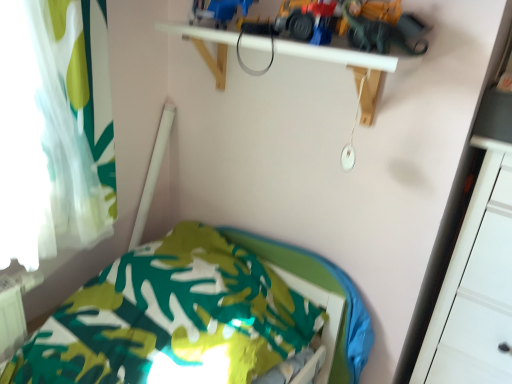
Question: Is point (384, 26) positioned closer to the camera than point (215, 13)?

Choices:
 (A) closer
 (B) farther

Answer: (A)

Question: Relative to blue plastic toy truck at upper center, the second toy in the right-to-left sequence, is yellow plastic toy car at upper center, arranged as the first toy car when viewed from the right, in front or behind?

Choices:
 (A) front
 (B) behind

Answer: (A)

Question: Which is nearer to the white matte shelf at upper center?

Choices:
 (A) white glossy drawer at right
 (B) blue plastic toy truck at upper center, the second toy in the right-to-left sequence
 (C) matte red toy car at upper center, the 2th toy car viewed from the right
 (D) green fabric bed at lower left
 (E) yellow plastic toy car at upper center, arranged as the first toy car when viewed from the right

Answer: (C)

Question: Estimate the real-world distances between objects in this image. Which object is farther from the blue plastic toy truck at upper center, the 1th toy positioned from the left?

Choices:
 (A) white glossy drawer at right
 (B) metallic yellow construction vehicle at upper center, the 1th toy in the right-to-left sequence
 (C) yellow plastic toy car at upper center, arranged as the first toy car when viewed from the right
 (D) matte red toy car at upper center, the 2th toy car viewed from the right
 (E) white sheer curtain at left

Answer: (A)